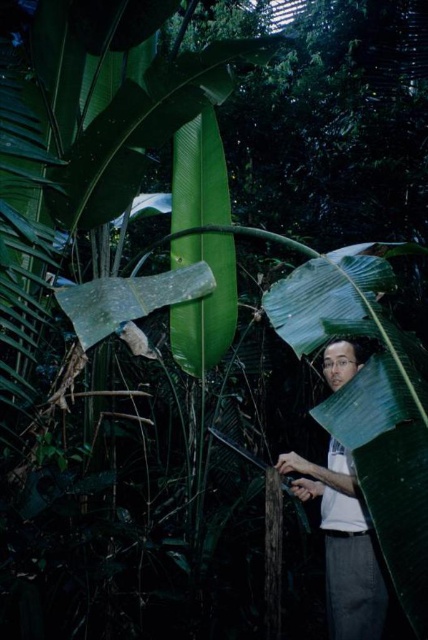
You are a hiker in the tropical forest and you see the white matte shirt at right and the green rough textured leaf at center. Which object is positioned higher up in the scene?

The green rough textured leaf at center is positioned higher up than the white matte shirt at right.

You are navigating through a dense tropical forest and need to locate two points marked in the scene. Which of the two points, point (329,563) or point (177,288), is closer to your current position?

Point (329,563) is closer to your current position because it is further to the viewer than point (177,288).

You are an explorer navigating through a dense tropical forest. You spot a white matte shirt at right located at point (x=342, y=545). Can you confirm if this location is in the foreground or background of the scene?

The white matte shirt at right located at point (x=342, y=545) is in the foreground of the scene because the foreground contains large, broad leaves of a banana plant with one leaf curving upwards, and the background is described as darker and more shadowed with thick canopy overhead.